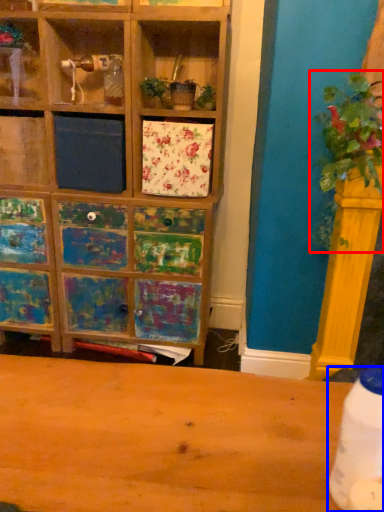
Question: Which object appears farthest to the camera in this image, floral arrangement (highlighted by a red box) or bottle (highlighted by a blue box)?

Choices:
 (A) floral arrangement
 (B) bottle

Answer: (A)